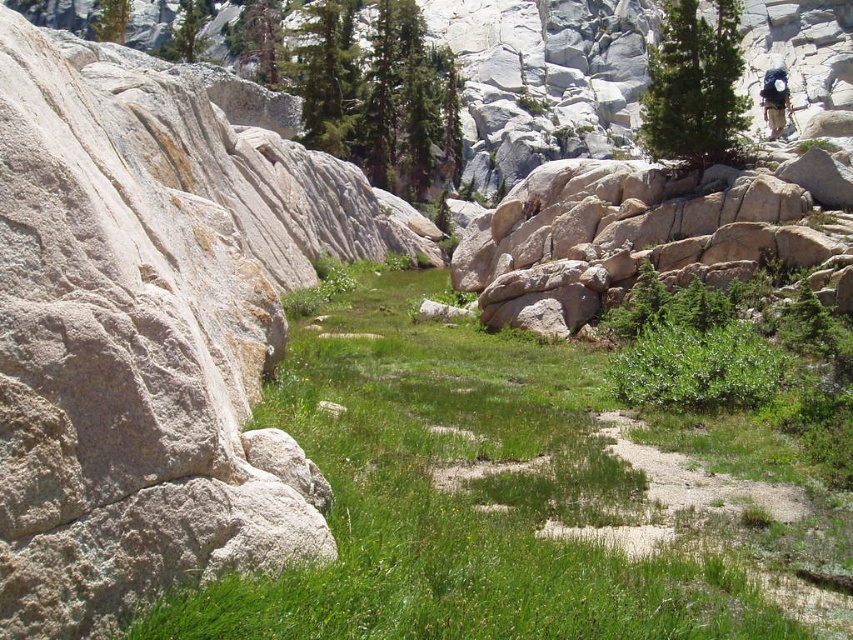
Is white rock at upper center further to the viewer compared to smooth granite boulder at upper right?

Yes, white rock at upper center is behind smooth granite boulder at upper right.

How distant is white rock at upper center from smooth granite boulder at upper right?

white rock at upper center and smooth granite boulder at upper right are 96.58 meters apart.

At what (x,y) coordinates should I click in order to perform the action: click on white rock at upper center. Please return your answer as a coordinate pair (x, y). The width and height of the screenshot is (853, 640). Looking at the image, I should click on (543, 76).

Find the location of `white rock at upper center`. white rock at upper center is located at coordinates (543, 76).

Is white rock at upper center to the left of green textured pine tree at upper right from the viewer's perspective?

Correct, you'll find white rock at upper center to the left of green textured pine tree at upper right.

Is point (538, 35) farther from viewer compared to point (651, 120)?

Yes, point (538, 35) is farther from viewer.

The width and height of the screenshot is (853, 640). Find the location of `white rock at upper center`. white rock at upper center is located at coordinates (543, 76).

Who is positioned more to the right, green textured pine tree at upper right or green leafy tree at upper center?

Positioned to the right is green textured pine tree at upper right.

Does point (685, 118) come farther from viewer compared to point (120, 29)?

No, (685, 118) is closer to viewer.

What do you see at coordinates (694, 84) in the screenshot? I see `green textured pine tree at upper right` at bounding box center [694, 84].

Locate an element on the screen. green textured pine tree at upper right is located at coordinates (694, 84).